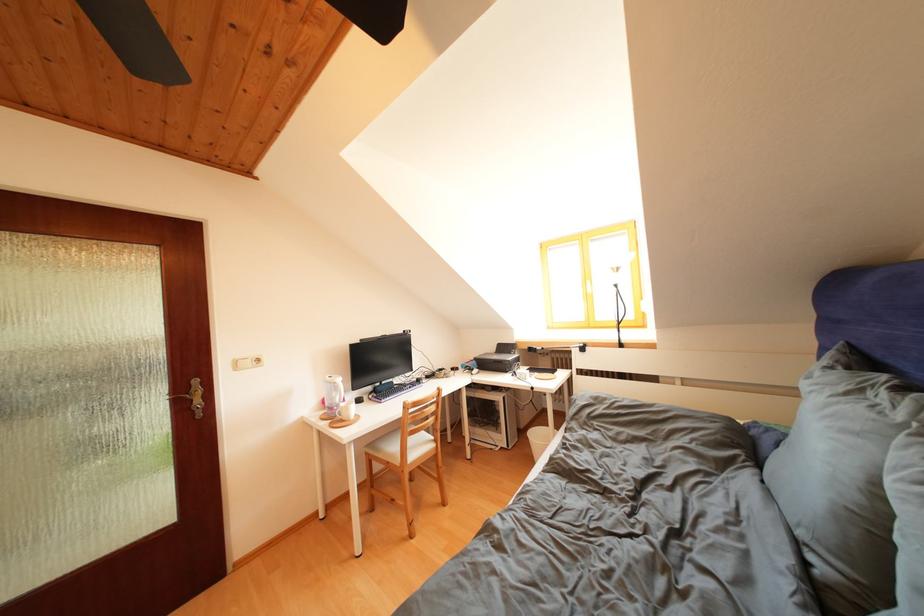
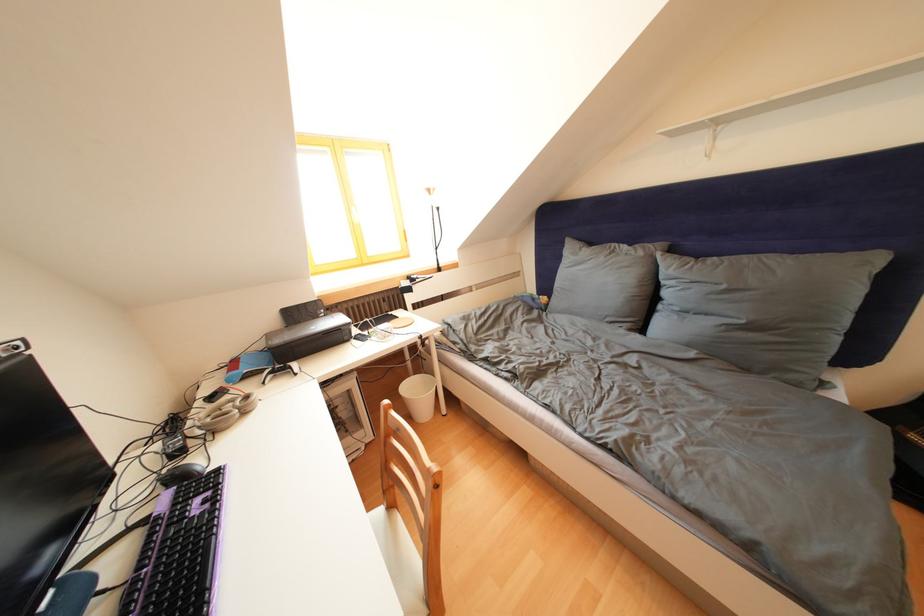
The point at (460, 374) is marked in the first image. Where is the corresponding point in the second image?

(220, 403)